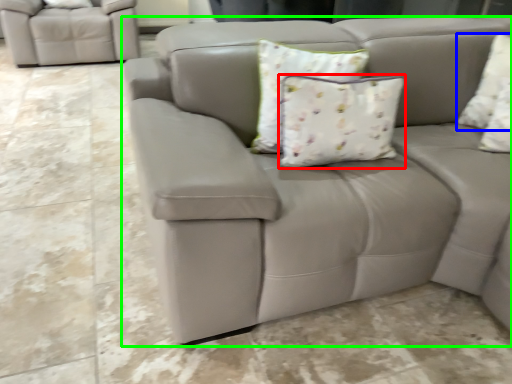
Question: Considering the real-world distances, which object is closest to pillow (highlighted by a red box)? pillow (highlighted by a blue box) or studio couch (highlighted by a green box).

Choices:
 (A) pillow
 (B) studio couch

Answer: (B)